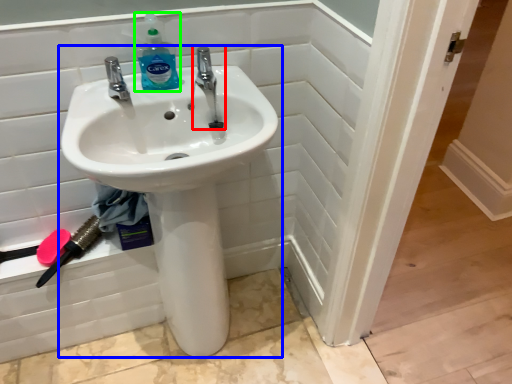
Question: Which object is positioned farthest from tap (highlighted by a red box)? Select from sink (highlighted by a blue box) and cleaning product (highlighted by a green box).

Choices:
 (A) sink
 (B) cleaning product

Answer: (A)